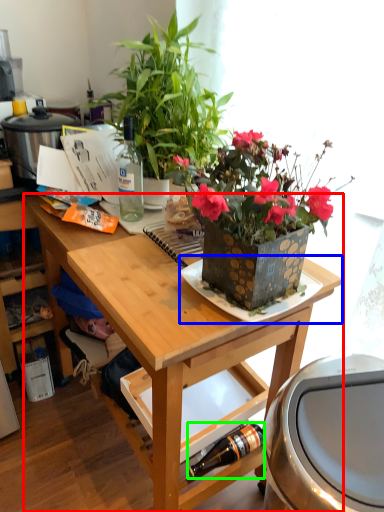
Question: Which object is positioned closest to desk (highlighted by a red box)? Select from plate (highlighted by a blue box) and bottle (highlighted by a green box).

Choices:
 (A) plate
 (B) bottle

Answer: (A)